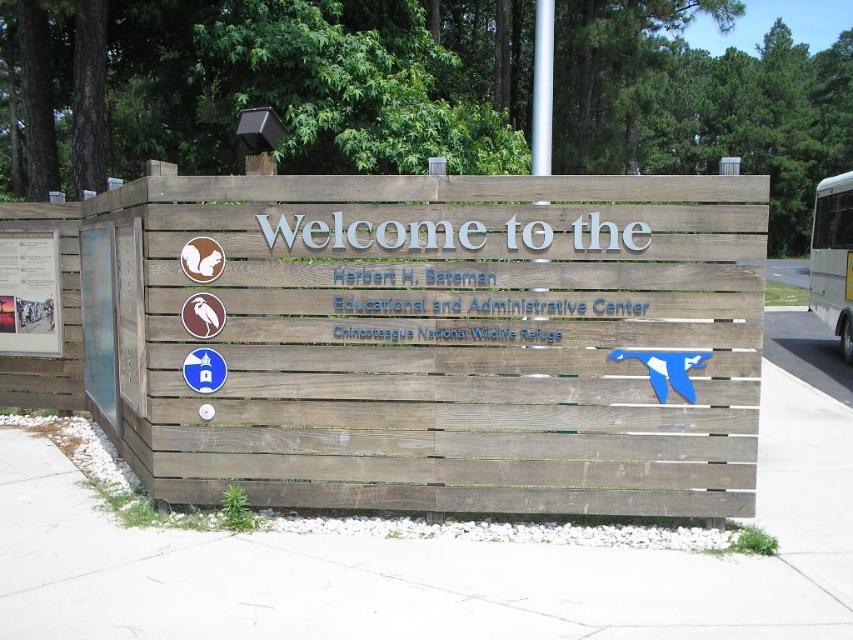
Question: Which object is closer to the camera taking this photo?

Choices:
 (A) white paper at left
 (B) wooden sign at left

Answer: (B)

Question: Is wooden sign at left closer to camera compared to white glossy bus at right?

Choices:
 (A) yes
 (B) no

Answer: (A)

Question: Does white paper at left have a larger size compared to wooden sign at left?

Choices:
 (A) yes
 (B) no

Answer: (B)

Question: Estimate the real-world distances between objects in this image. Which object is closer to the wooden sign at left?

Choices:
 (A) white glossy bus at right
 (B) white paper at left

Answer: (B)

Question: Which point is closer to the camera?

Choices:
 (A) white paper at left
 (B) wooden sign at left
 (C) white glossy bus at right

Answer: (B)

Question: Is white paper at left closer to the viewer compared to white glossy bus at right?

Choices:
 (A) no
 (B) yes

Answer: (B)